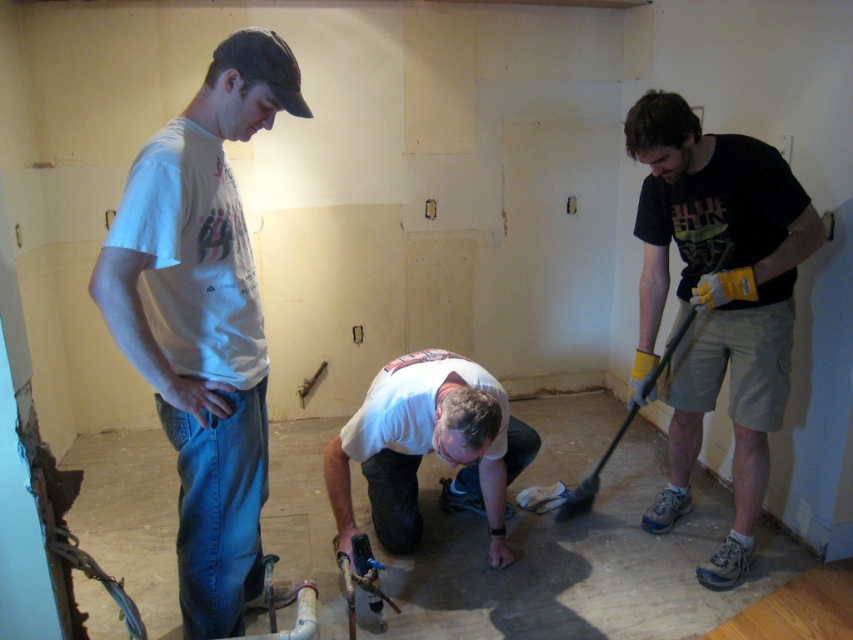
Is point (115, 230) positioned in front of point (756, 164)?

Yes, point (115, 230) is in front of point (756, 164).

Is point (189, 301) positioned after point (682, 220)?

No, it is not.

I want to click on white cotton t-shirt at center, so click(x=202, y=321).

Find the location of `white cotton t-shirt at center`. white cotton t-shirt at center is located at coordinates (202, 321).

Does smooth concrete floor at center lie in front of white matte shirt at center?

No, smooth concrete floor at center is behind white matte shirt at center.

Does smooth concrete floor at center have a lesser height compared to white matte shirt at center?

Yes, smooth concrete floor at center is shorter than white matte shirt at center.

Describe the element at coordinates (573, 564) in the screenshot. The height and width of the screenshot is (640, 853). I see `smooth concrete floor at center` at that location.

Find the location of `smooth concrete floor at center`. smooth concrete floor at center is located at coordinates (573, 564).

In the scene shown: Between black cotton t-shirt at right and white matte shirt at center, which one appears on the right side from the viewer's perspective?

From the viewer's perspective, black cotton t-shirt at right appears more on the right side.

Which is in front, point (671, 232) or point (419, 529)?

Point (671, 232) is in front.

Locate an element on the screen. Image resolution: width=853 pixels, height=640 pixels. black cotton t-shirt at right is located at coordinates (718, 300).